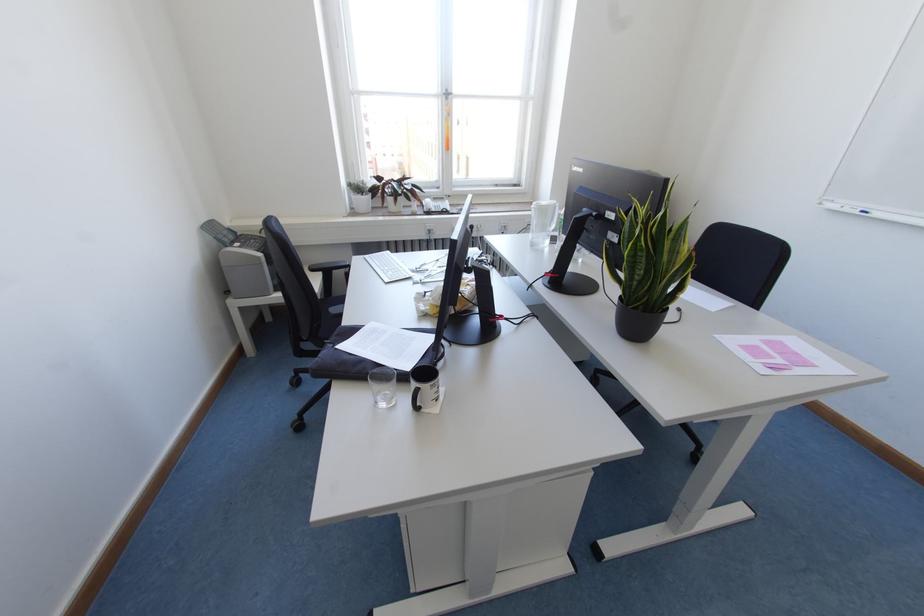
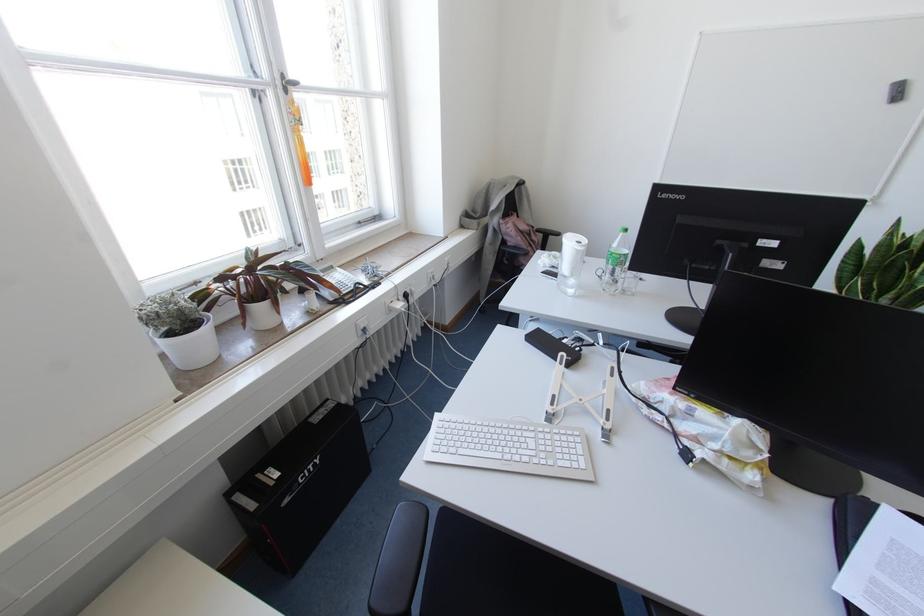
Find the pixel in the second image that matches (x=387, y=251) in the first image.

(435, 414)